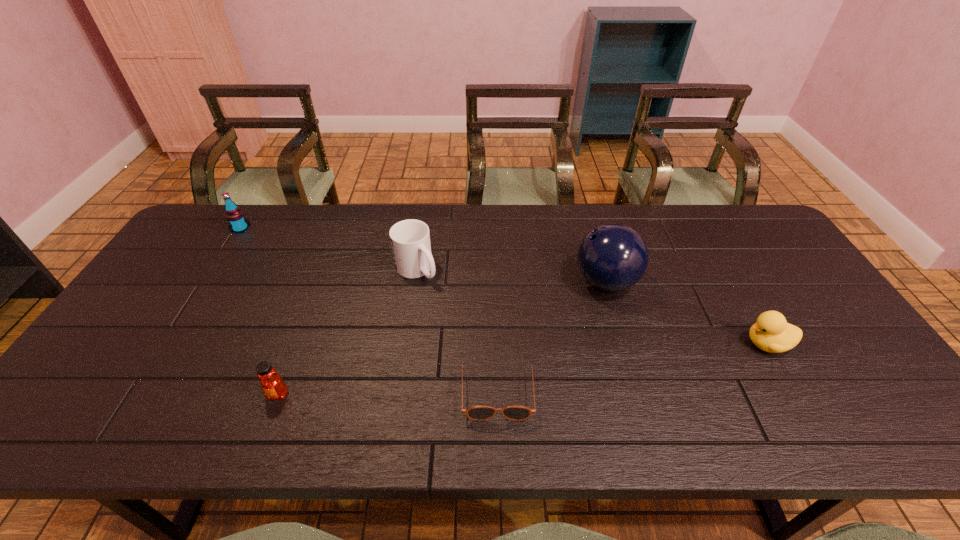
Locate an element on the screen. free space between the shortest object and the honey is located at coordinates (388, 392).

You are a GUI agent. You are given a task and a screenshot of the screen. Output one action in this format:
    pyautogui.click(x=<x>, y=<y>)
    Task: Click on the vacant area that lies between the rightmost object and the mug
    
    Given the screenshot: What is the action you would take?
    (x=591, y=307)

Locate an element on the screen. This screenshot has height=540, width=960. unoccupied position between the rightmost object and the fourth object from left to right is located at coordinates (633, 366).

Locate an element on the screen. The height and width of the screenshot is (540, 960). vacant space in between the honey and the shortest object is located at coordinates (388, 392).

Identify the location of empty space between the shortest object and the second object from left to right. This screenshot has width=960, height=540. pos(388,392).

Identify which object is located as the nearest to the shortest object. Please provide its 2D coordinates. Your answer should be formatted as a tuple, i.e. [(x, y)], where the tuple contains the x and y coordinates of a point satisfying the conditions above.

[(612, 257)]

This screenshot has height=540, width=960. In order to click on object that stands as the second closest to the farthest object in this screenshot , I will do `click(273, 386)`.

In order to click on free point that satisfies the following two spatial constraints: 1. on the front-facing side of the rightmost object; 2. on the front-facing side of the third object from right to left in this screenshot , I will do `click(793, 388)`.

Identify the location of free space that satisfies the following two spatial constraints: 1. on the surface of the second object from right to left near the finger holes; 2. on the front label of the fifth object from right to left. (638, 394).